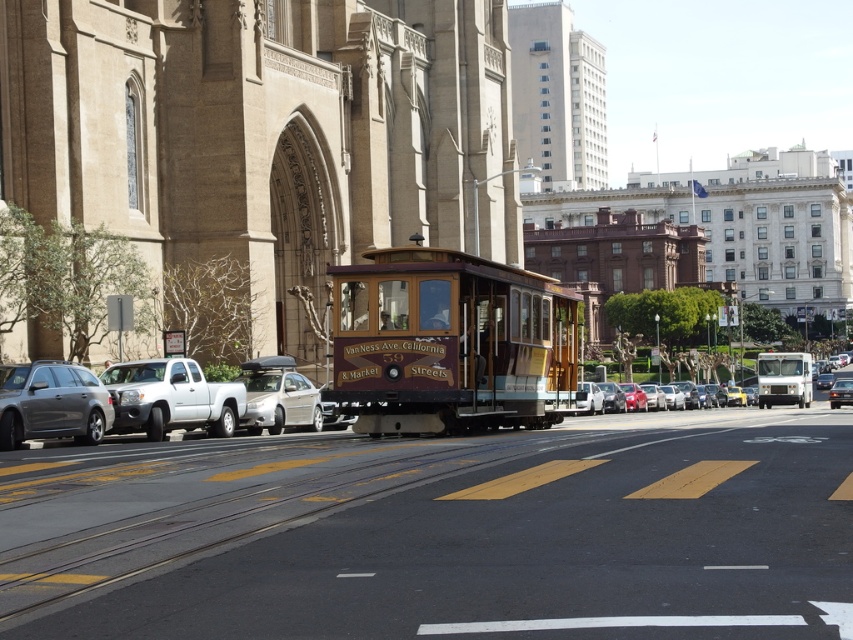
Question: Is brown stone church at center above metallic silver sedan at center?

Choices:
 (A) no
 (B) yes

Answer: (B)

Question: Among these points, which one is nearest to the camera?

Choices:
 (A) tap(86, 378)
 (B) tap(635, 404)
 (C) tap(543, 524)
 (D) tap(453, 337)

Answer: (C)

Question: Does matte gray station wagon at left come behind metallic silver sedan at center?

Choices:
 (A) no
 (B) yes

Answer: (A)

Question: Which point is farther to the camera?

Choices:
 (A) metallic silver sedan at center
 (B) matte gray station wagon at left
 (C) brown stone church at center

Answer: (A)

Question: Considering the relative positions of brown stone church at center and matte gray station wagon at left in the image provided, where is brown stone church at center located with respect to matte gray station wagon at left?

Choices:
 (A) right
 (B) left

Answer: (A)

Question: Which of the following is the farthest from the observer?

Choices:
 (A) brown stone church at center
 (B) wooden polished cable car at center
 (C) matte gray station wagon at left

Answer: (A)